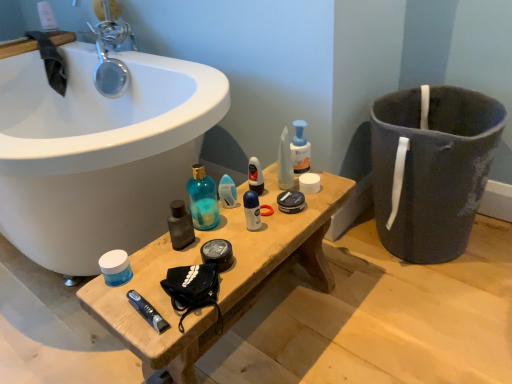
Where is `free location to the right of blue matte jar at center, the first mouthwash in the left-to-right sequence`? free location to the right of blue matte jar at center, the first mouthwash in the left-to-right sequence is located at coordinates (182, 266).